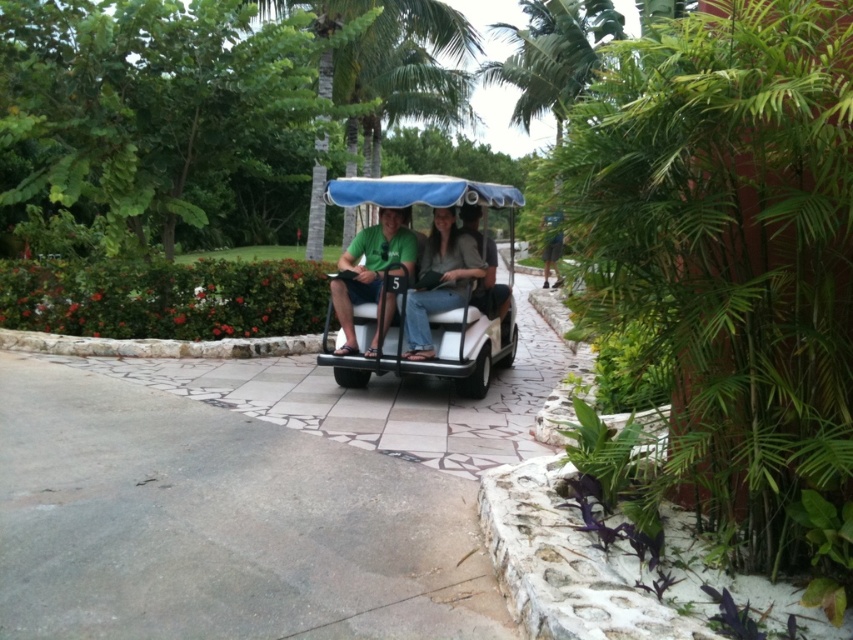
Can you confirm if green matte shirt at center is positioned to the left of matte gray shirt at center?

Indeed, green matte shirt at center is positioned on the left side of matte gray shirt at center.

Does point (344, 323) lie in front of point (508, 305)?

Yes, it is.

Where is `green matte shirt at center`? green matte shirt at center is located at coordinates (370, 268).

Between denim jeans at center and matte gray shirt at center, which one is positioned lower?

Positioned lower is denim jeans at center.

I want to click on denim jeans at center, so click(x=440, y=280).

Between white matte golf cart at center and green matte shirt at center, which one has more height?

white matte golf cart at center

Measure the distance between point (x=477, y=312) and camera.

Point (x=477, y=312) and camera are 6.20 meters apart.

Image resolution: width=853 pixels, height=640 pixels. What are the coordinates of `white matte golf cart at center` in the screenshot? It's located at (431, 288).